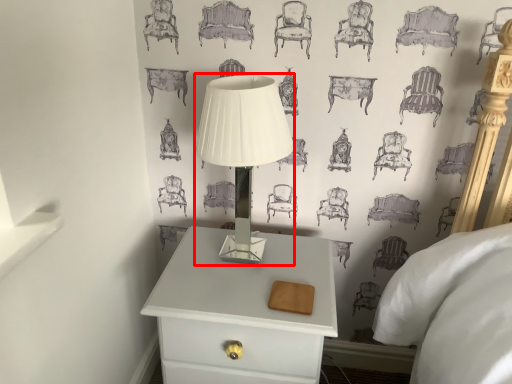
Question: From the image's perspective, considering the relative positions of table lamp (annotated by the red box) and nightstand in the image provided, where is table lamp (annotated by the red box) located with respect to the staircase?

Choices:
 (A) below
 (B) above

Answer: (B)